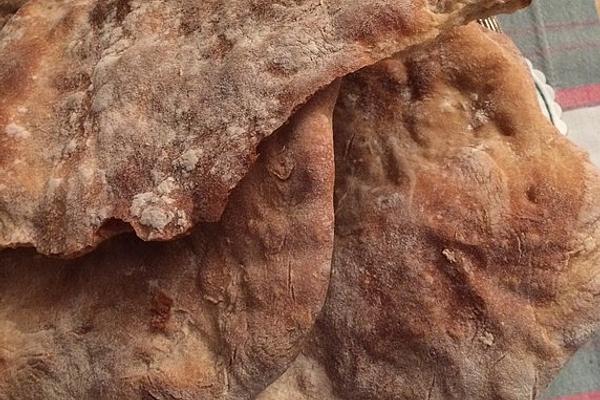
Where is `light gray table top`? The image size is (600, 400). light gray table top is located at coordinates (585, 122).